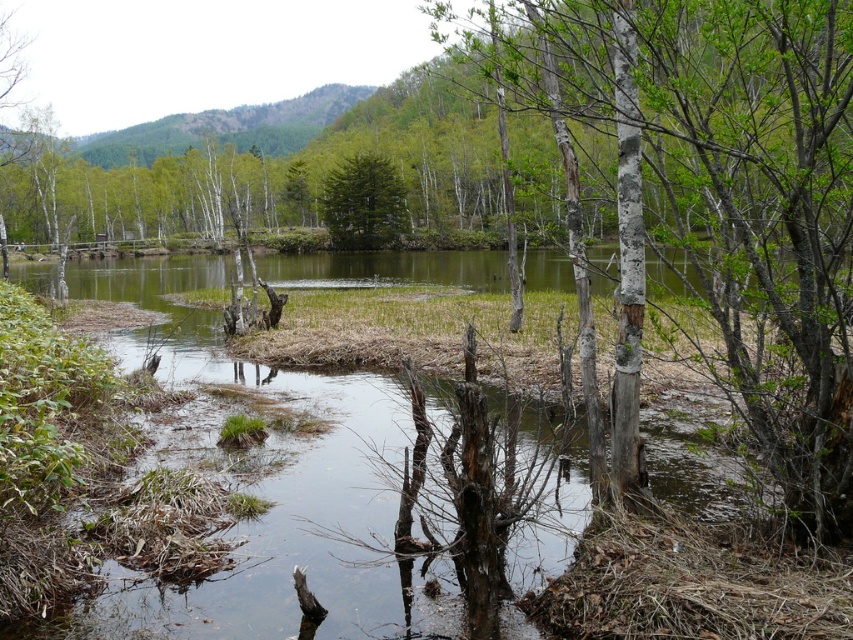
Question: Can you confirm if smooth bark tree at center is thinner than green matte tree at center?

Choices:
 (A) no
 (B) yes

Answer: (A)

Question: Is the position of smooth bark tree at center more distant than that of green matte tree at center?

Choices:
 (A) yes
 (B) no

Answer: (B)

Question: Which of the following is the farthest from the observer?

Choices:
 (A) (595, 77)
 (B) (335, 195)

Answer: (B)

Question: Is smooth bark tree at center behind green matte tree at center?

Choices:
 (A) yes
 (B) no

Answer: (B)

Question: Which point is closer to the camera?

Choices:
 (A) smooth bark tree at center
 (B) green matte tree at center

Answer: (A)